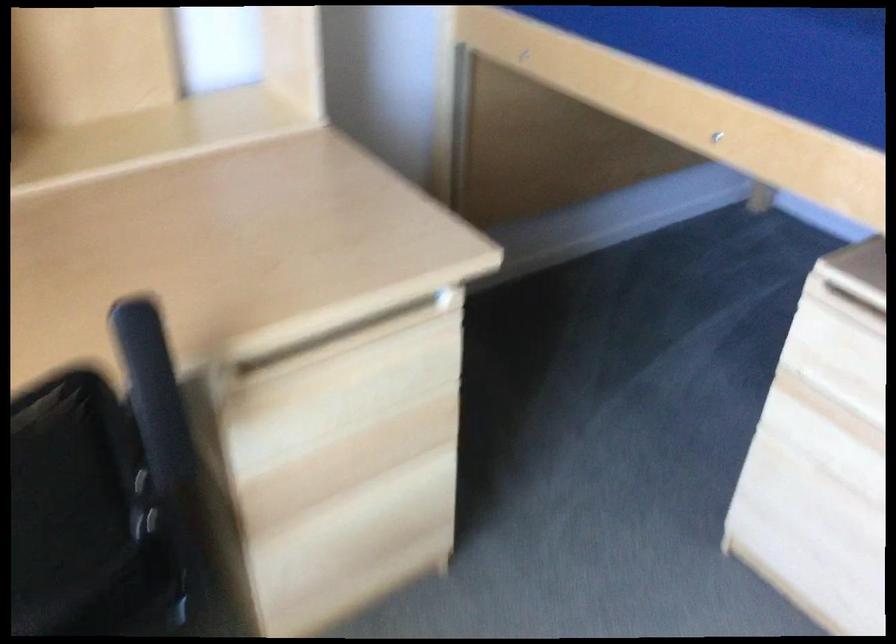
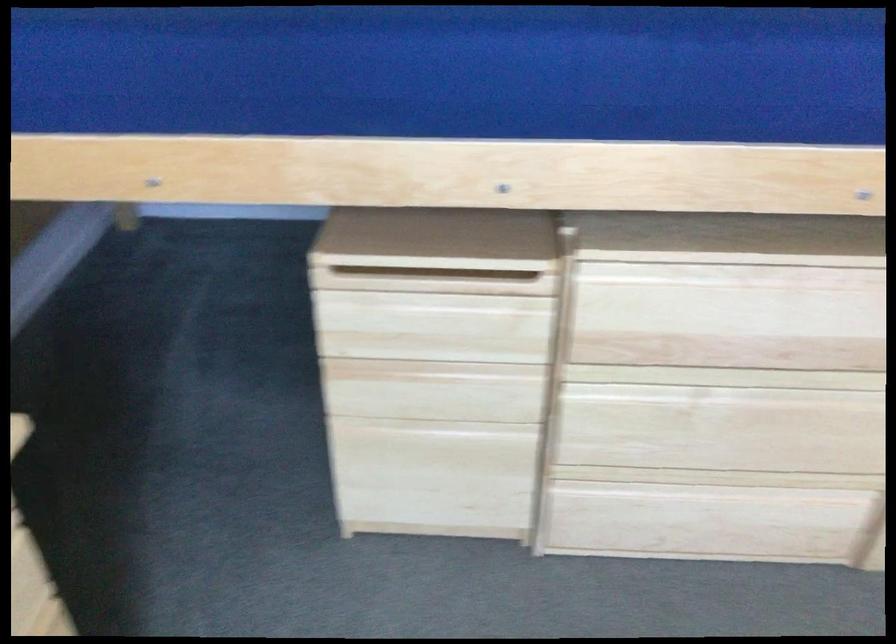
Question: The camera is either moving clockwise (left) or counter-clockwise (right) around the object. The first image is from the beginning of the video and the second image is from the end. Is the camera moving left or right when shooting the video?

Choices:
 (A) Left
 (B) Right

Answer: (A)